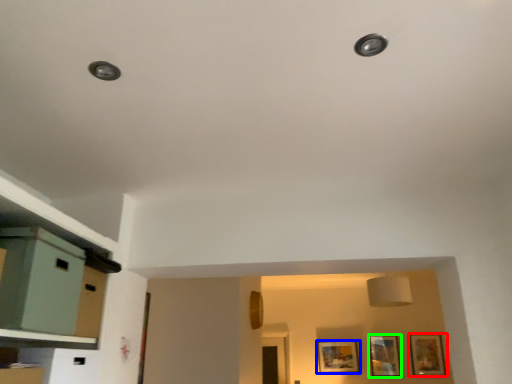
Question: Which object is positioned farthest from picture frame (highlighted by a red box)? Select from picture frame (highlighted by a blue box) and picture frame (highlighted by a green box).

Choices:
 (A) picture frame
 (B) picture frame

Answer: (A)